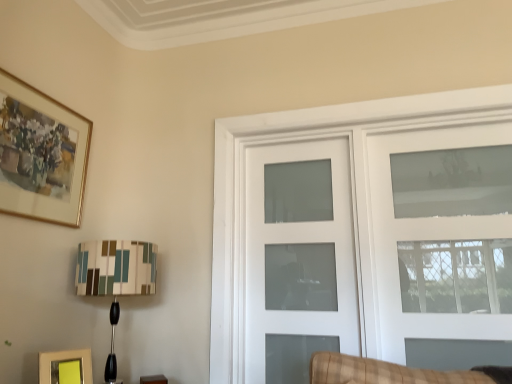
Question: Is matte yellow picture frame at lower left, the second picture frame from the left, wider or thinner than clear glass door at upper right, the 2th door from the left?

Choices:
 (A) wide
 (B) thin

Answer: (A)

Question: From a real-world perspective, is matte yellow picture frame at lower left, which ranks as the first picture frame in bottom-to-top order, physically located above or below clear glass door at upper right, the 2th door from the left?

Choices:
 (A) below
 (B) above

Answer: (A)

Question: Estimate the real-world distances between objects in this image. Which object is closer to the multicolored fabric lampshade at lower left?

Choices:
 (A) clear glass door at upper right, which ranks as the first door in right-to-left order
 (B) white frosted glass door at center, which is the first door from left to right
 (C) gold-framed painting at upper left, the second picture frame from the bottom
 (D) matte yellow picture frame at lower left, acting as the 2th picture frame starting from the top

Answer: (D)

Question: Considering the real-world distances, which object is farthest from the clear glass door at upper right, which ranks as the first door in right-to-left order?

Choices:
 (A) gold-framed painting at upper left, the second picture frame from the bottom
 (B) white frosted glass door at center, which is the first door from left to right
 (C) matte yellow picture frame at lower left, which ranks as the first picture frame in bottom-to-top order
 (D) multicolored fabric lampshade at lower left

Answer: (A)